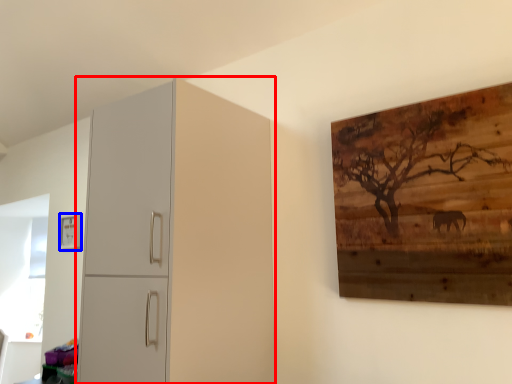
Question: Which object appears closest to the camera in this image, cupboard (highlighted by a red box) or picture frame (highlighted by a blue box)?

Choices:
 (A) cupboard
 (B) picture frame

Answer: (A)